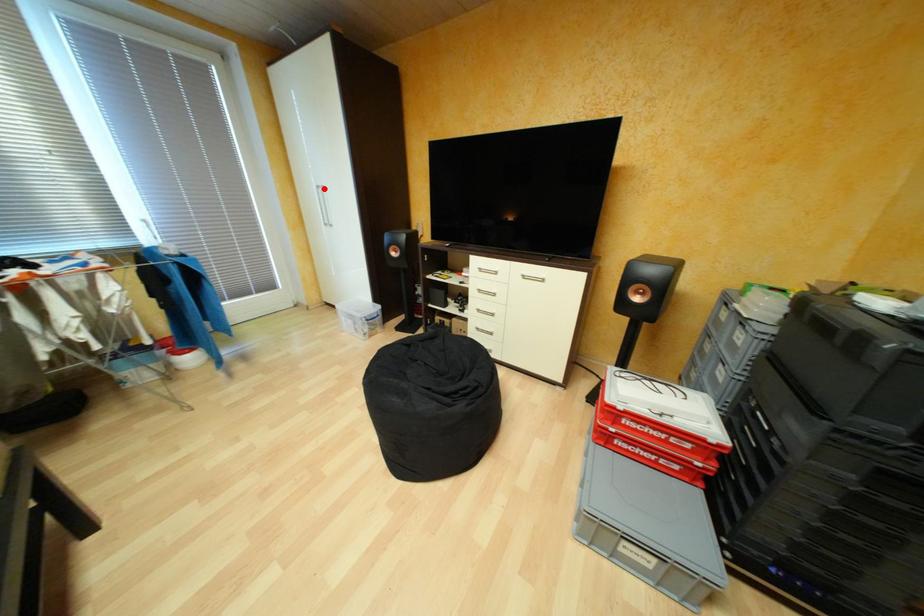
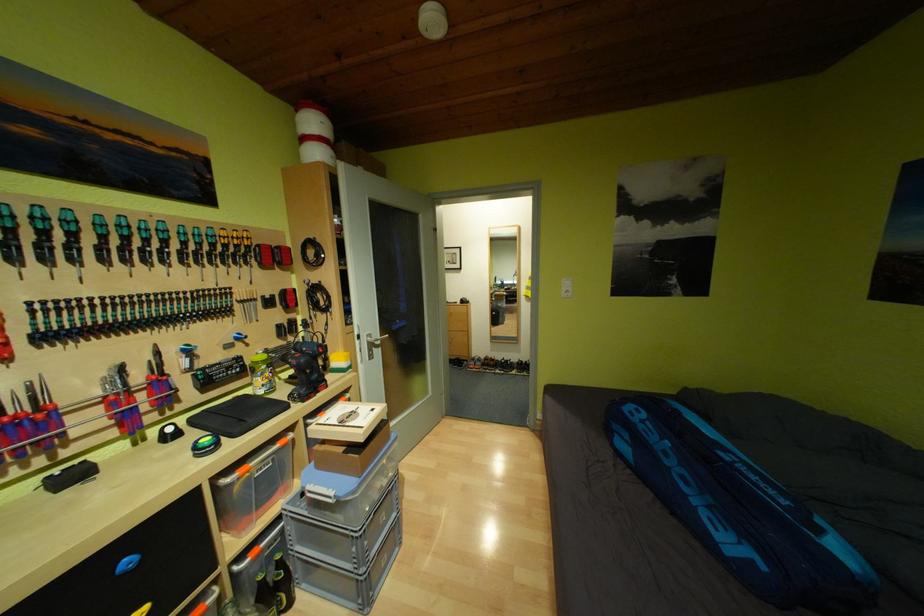
Question: I am providing you with two images of the same scene from different viewpoints. A red point is marked on the first image. Can you still see the location of the red point in image 2?

Choices:
 (A) Yes
 (B) No

Answer: (B)